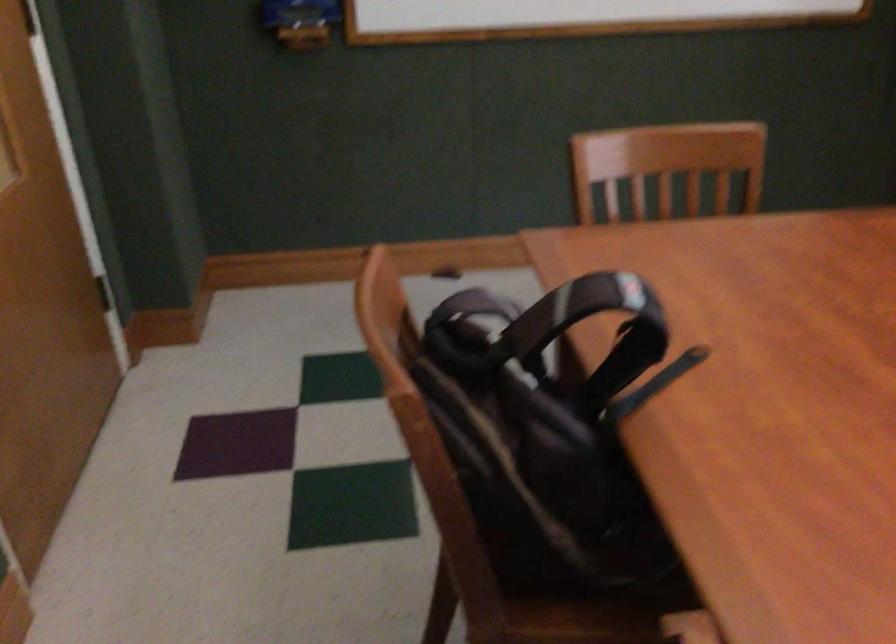
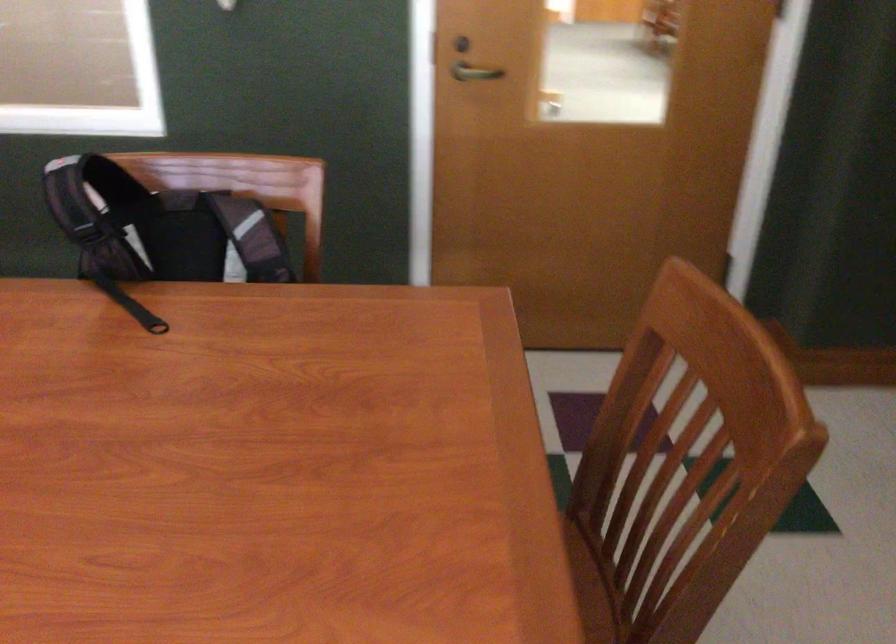
Locate, in the second image, the point that corresponds to point 504,363 in the first image.

(159, 228)